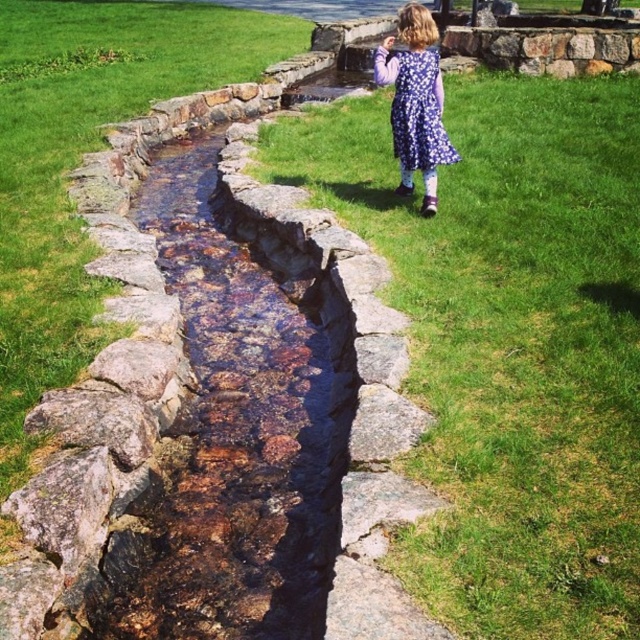
Question: Which point is farther to the camera?

Choices:
 (A) green grass at center
 (B) purple floral dress at upper right

Answer: (B)

Question: Is green grass at center positioned before purple floral dress at upper right?

Choices:
 (A) yes
 (B) no

Answer: (A)

Question: Which of the following is the farthest from the observer?

Choices:
 (A) (540, 468)
 (B) (394, 74)

Answer: (B)

Question: Is green grass at center wider than purple floral dress at upper right?

Choices:
 (A) yes
 (B) no

Answer: (A)

Question: Is green grass at center to the left of purple floral dress at upper right from the viewer's perspective?

Choices:
 (A) yes
 (B) no

Answer: (B)

Question: Which of the following is the farthest from the observer?

Choices:
 (A) (406, 65)
 (B) (320, 161)

Answer: (B)